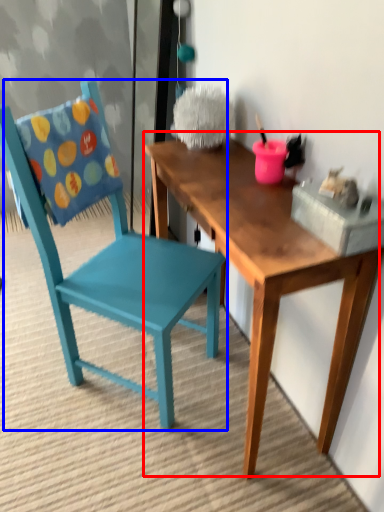
Question: Which object appears closest to the camera in this image, table (highlighted by a red box) or chair (highlighted by a blue box)?

Choices:
 (A) table
 (B) chair

Answer: (A)